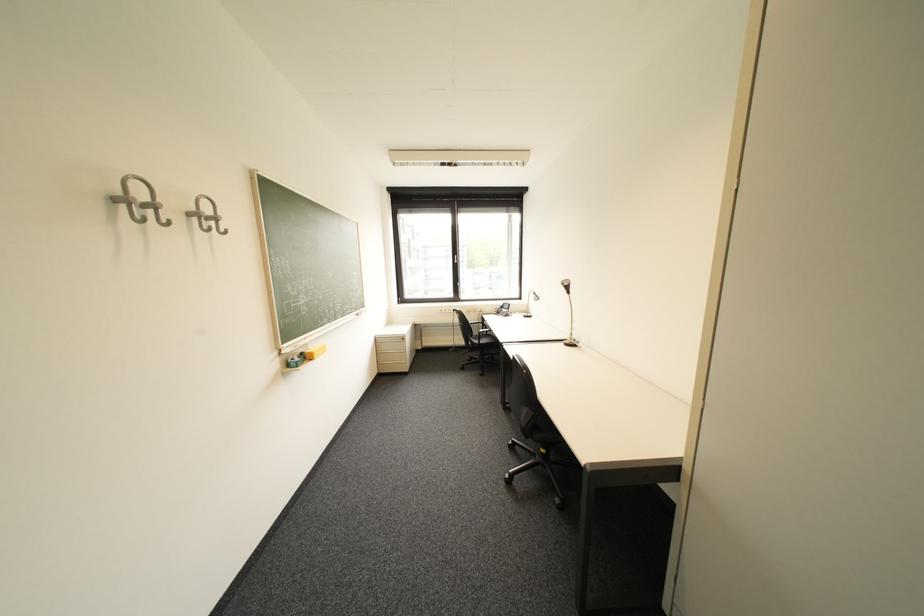
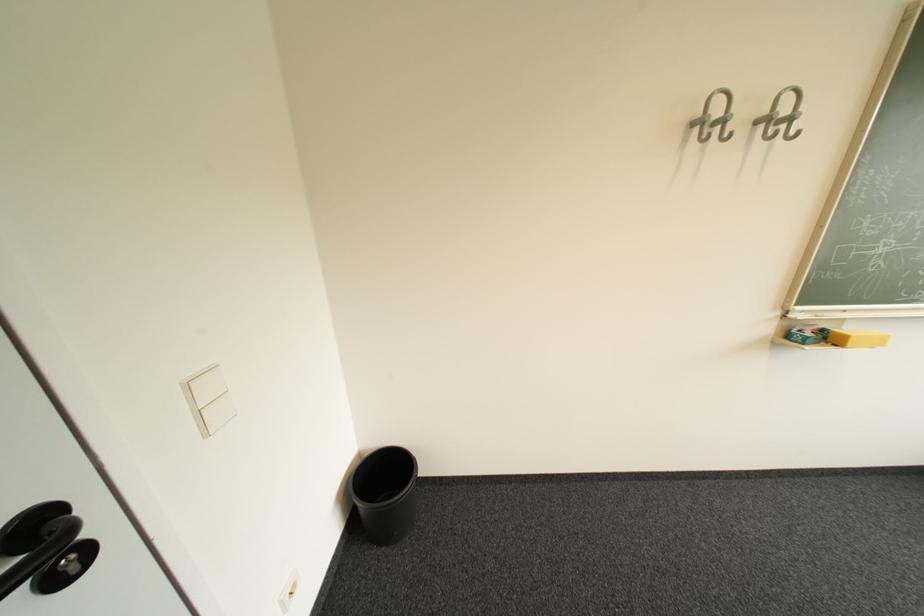
In the scene shown: Based on the continuous images, in which direction is the camera rotating?

The camera's rotation is toward left-down.